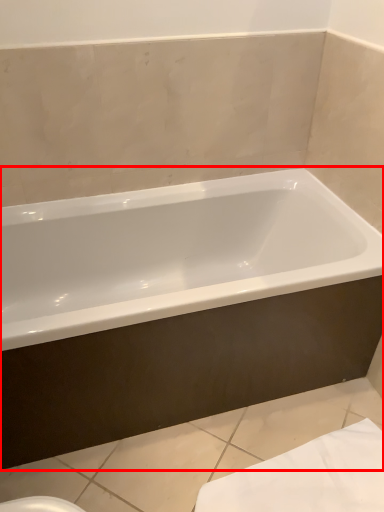
Question: Observing the image, what is the correct spatial positioning of bathtub (annotated by the red box) in reference to bath towel?

Choices:
 (A) right
 (B) left

Answer: (B)